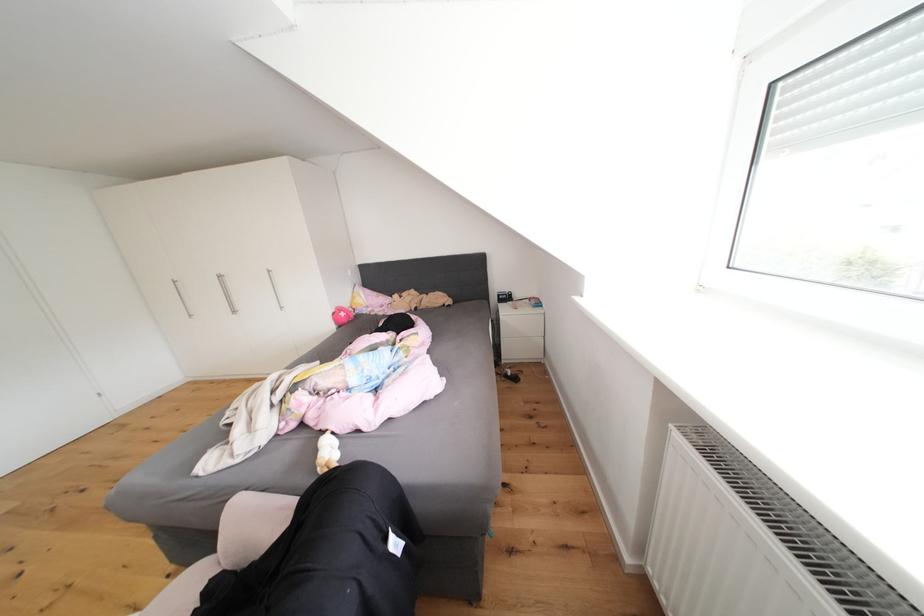
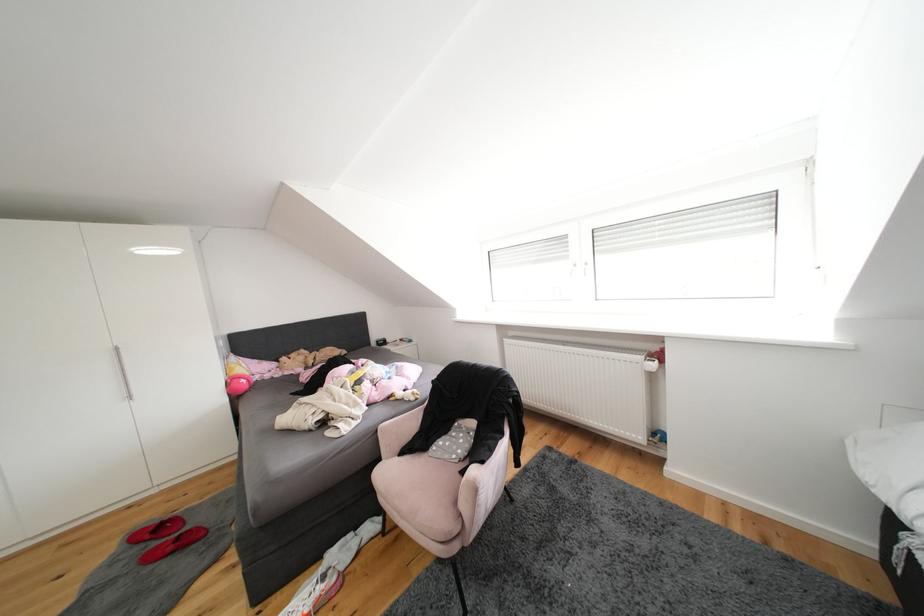
Where in the second image is the point corresponding to point 304,392 from the first image?

(368, 386)